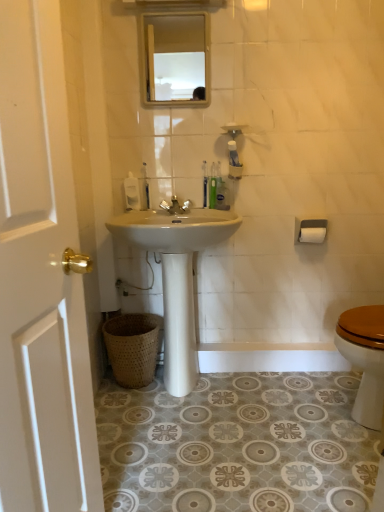
Question: Considering the relative sizes of white glossy sink at center and translucent plastic toothbrush at center, which appears as the 2th toothbrush when viewed from the right, in the image provided, is white glossy sink at center smaller than translucent plastic toothbrush at center, which appears as the 2th toothbrush when viewed from the right,?

Choices:
 (A) no
 (B) yes

Answer: (A)

Question: Does white glossy sink at center have a lesser width compared to translucent plastic toothbrush at center, which appears as the 2th toothbrush when viewed from the right?

Choices:
 (A) no
 (B) yes

Answer: (A)

Question: Is white glossy sink at center taller than translucent plastic toothbrush at center, the 2th toothbrush viewed from the left?

Choices:
 (A) yes
 (B) no

Answer: (A)

Question: Considering the relative positions of white glossy sink at center and translucent plastic toothbrush at center, the 2th toothbrush viewed from the left, in the image provided, is white glossy sink at center to the right of translucent plastic toothbrush at center, the 2th toothbrush viewed from the left, from the viewer's perspective?

Choices:
 (A) yes
 (B) no

Answer: (B)

Question: Could translucent plastic toothbrush at center, the 2th toothbrush viewed from the left, be considered to be inside white glossy sink at center?

Choices:
 (A) yes
 (B) no

Answer: (B)

Question: Considering the positions of point (203, 193) and point (180, 212), is point (203, 193) closer or farther from the camera than point (180, 212)?

Choices:
 (A) farther
 (B) closer

Answer: (A)

Question: From the image's perspective, is translucent plastic toothbrush at center, the 2th toothbrush viewed from the left, located above or below silver metallic faucet at center?

Choices:
 (A) below
 (B) above

Answer: (B)

Question: Considering the positions of translucent plastic toothbrush at center, which appears as the 2th toothbrush when viewed from the right, and silver metallic faucet at center in the image, is translucent plastic toothbrush at center, which appears as the 2th toothbrush when viewed from the right, bigger or smaller than silver metallic faucet at center?

Choices:
 (A) small
 (B) big

Answer: (A)

Question: Considering their positions, is translucent plastic toothbrush at center, the 2th toothbrush viewed from the left, located in front of or behind silver metallic faucet at center?

Choices:
 (A) behind
 (B) front

Answer: (A)

Question: Is brown woven basket at lower left wider or thinner than white glossy sink at center?

Choices:
 (A) thin
 (B) wide

Answer: (A)

Question: Is brown woven basket at lower left bigger or smaller than white glossy sink at center?

Choices:
 (A) big
 (B) small

Answer: (B)

Question: Is brown woven basket at lower left in front of or behind white glossy sink at center in the image?

Choices:
 (A) behind
 (B) front

Answer: (A)

Question: From a real-world perspective, is brown woven basket at lower left positioned above or below white glossy sink at center?

Choices:
 (A) above
 (B) below

Answer: (B)

Question: From a real-world perspective, is white wood door at left positioned above or below white glossy sink at center?

Choices:
 (A) above
 (B) below

Answer: (A)

Question: Is white wood door at left in front of or behind white glossy sink at center in the image?

Choices:
 (A) front
 (B) behind

Answer: (A)